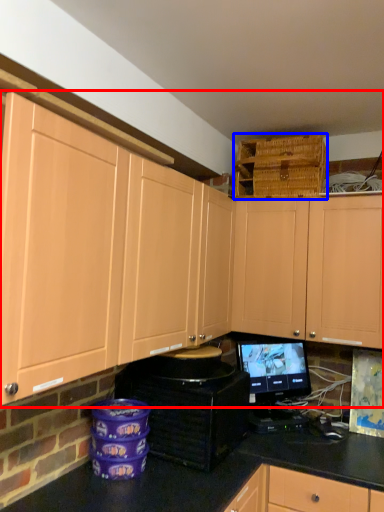
Question: Which point is further to the camera, cabinetry (highlighted by a red box) or basket (highlighted by a blue box)?

Choices:
 (A) cabinetry
 (B) basket

Answer: (B)